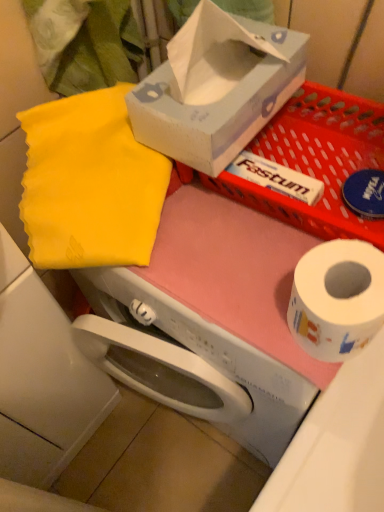
Describe the element at coordinates (216, 88) in the screenshot. I see `matte white tissue box at upper center` at that location.

The width and height of the screenshot is (384, 512). Describe the element at coordinates (337, 298) in the screenshot. I see `white paper at right` at that location.

Find the location of `yellow fabric at upper left`. yellow fabric at upper left is located at coordinates (90, 184).

Which of these two, yellow fabric at upper left or white paper at right, stands shorter?

white paper at right.

Considering the relative positions of yellow fabric at upper left and white paper at right in the image provided, is yellow fabric at upper left in front of white paper at right?

No, it is not.

Does yellow fabric at upper left appear on the left side of white paper at right?

Yes.

Is yellow fabric at upper left with white paper at right?

No, yellow fabric at upper left is not next to white paper at right.

Is yellow fabric at upper left looking in the opposite direction of matte white tissue box at upper center?

No, yellow fabric at upper left is not facing the opposite direction of matte white tissue box at upper center.

Is yellow fabric at upper left at the left side of matte white tissue box at upper center?

Yes, yellow fabric at upper left is to the left of matte white tissue box at upper center.

Which point is more forward, (49,237) or (185,38)?

The point (185,38) is more forward.

From a real-world perspective, is white paper at right located beneath matte white tissue box at upper center?

Yes, from a real-world perspective, white paper at right is below matte white tissue box at upper center.

Can you confirm if white paper at right is shorter than matte white tissue box at upper center?

Indeed, white paper at right has a lesser height compared to matte white tissue box at upper center.

Looking at this image, who is smaller, white paper at right or matte white tissue box at upper center?

white paper at right is smaller.

In the scene shown: Considering the positions of objects white paper at right and matte white tissue box at upper center in the image provided, who is in front, white paper at right or matte white tissue box at upper center?

white paper at right is more forward.

Is matte white tissue box at upper center spatially inside yellow fabric at upper left, or outside of it?

matte white tissue box at upper center is not enclosed by yellow fabric at upper left.

Can you confirm if matte white tissue box at upper center is wider than yellow fabric at upper left?

Indeed, matte white tissue box at upper center has a greater width compared to yellow fabric at upper left.

Is the depth of matte white tissue box at upper center greater than that of yellow fabric at upper left?

No, matte white tissue box at upper center is in front of yellow fabric at upper left.

Does matte white tissue box at upper center lie behind white paper at right?

That is True.

Does matte white tissue box at upper center appear on the left side of white paper at right?

Yes.

Is matte white tissue box at upper center beside white paper at right?

There is a gap between matte white tissue box at upper center and white paper at right.

Is matte white tissue box at upper center positioned with its back to white paper at right?

No, white paper at right is not at the back of matte white tissue box at upper center.

Locate an element on the screen. toilet paper positioned vertically above the yellow fabric at upper left (from a real-world perspective) is located at coordinates (337, 298).

Considering the relative sizes of white paper at right and yellow fabric at upper left in the image provided, is white paper at right shorter than yellow fabric at upper left?

Correct, white paper at right is not as tall as yellow fabric at upper left.

From the image's perspective, which one is positioned lower, white paper at right or yellow fabric at upper left?

white paper at right.

I want to click on cloth located underneath the white paper at right (from a real-world perspective), so click(x=90, y=184).

In the image, there is a yellow fabric at upper left. Identify the location of box above it (from the image's perspective). (216, 88).

Based on their spatial positions, is yellow fabric at upper left or white paper at right further from matte white tissue box at upper center?

white paper at right.

Estimate the real-world distances between objects in this image. Which object is further from yellow fabric at upper left, white paper at right or matte white tissue box at upper center?

white paper at right is further to yellow fabric at upper left.

Considering their positions, is matte white tissue box at upper center positioned closer to white paper at right than yellow fabric at upper left?

The object closer to white paper at right is matte white tissue box at upper center.

Which object lies nearer to the anchor point yellow fabric at upper left, matte white tissue box at upper center or white paper at right?

matte white tissue box at upper center is positioned closer to the anchor yellow fabric at upper left.

From the image, which object appears to be farther from matte white tissue box at upper center, white paper at right or yellow fabric at upper left?

white paper at right lies further to matte white tissue box at upper center than the other object.

Estimate the real-world distances between objects in this image. Which object is closer to white paper at right, yellow fabric at upper left or matte white tissue box at upper center?

Based on the image, matte white tissue box at upper center appears to be nearer to white paper at right.

Locate an element on the screen. The height and width of the screenshot is (512, 384). cloth that lies between matte white tissue box at upper center and white paper at right from top to bottom is located at coordinates (90, 184).